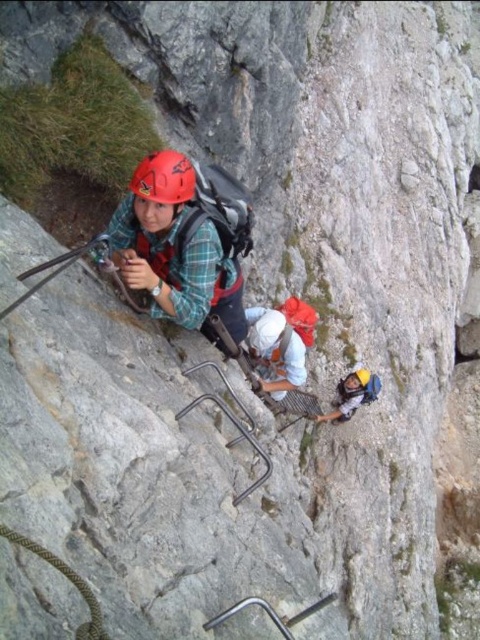
Between matte red helmet at upper left and matte yellow helmet at lower center, which one appears on the right side from the viewer's perspective?

From the viewer's perspective, matte yellow helmet at lower center appears more on the right side.

From the picture: Can you confirm if matte red helmet at upper left is thinner than matte yellow helmet at lower center?

Yes.

Is point (145, 157) positioned in front of point (349, 387)?

That is True.

Locate an element on the screen. This screenshot has height=640, width=480. matte red helmet at upper left is located at coordinates (164, 177).

Can you confirm if matte black helmet at upper center is bigger than white fabric helmet at center?

Correct, matte black helmet at upper center is larger in size than white fabric helmet at center.

Which of these two, matte black helmet at upper center or white fabric helmet at center, stands shorter?

white fabric helmet at center is shorter.

Is point (229, 268) closer to viewer compared to point (271, 314)?

That is True.

Where is `matte black helmet at upper center`? This screenshot has width=480, height=640. matte black helmet at upper center is located at coordinates (183, 241).

Is white fabric helmet at center wider than matte yellow helmet at lower center?

No.

Where is `white fabric helmet at center`? The width and height of the screenshot is (480, 640). white fabric helmet at center is located at coordinates (276, 349).

Which is behind, point (265, 378) or point (367, 387)?

The point (367, 387) is behind.

Locate an element on the screen. white fabric helmet at center is located at coordinates (x=276, y=349).